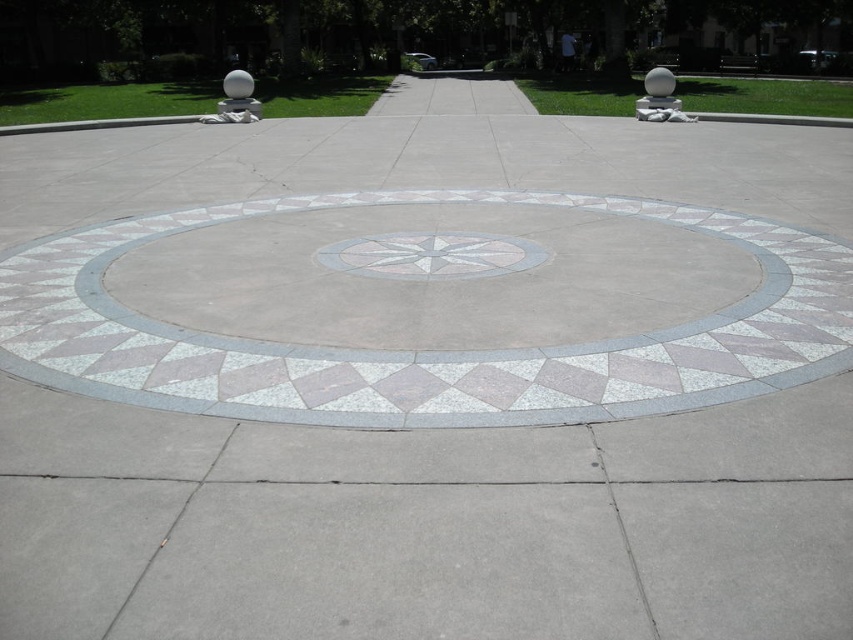
Looking at this image, does white mosaic circle at center appear on the right side of white marble compass at center?

Indeed, white mosaic circle at center is positioned on the right side of white marble compass at center.

Which is above, white mosaic circle at center or white marble compass at center?

white mosaic circle at center is above.

Is point (347, 28) closer to camera compared to point (433, 264)?

No, it is not.

Image resolution: width=853 pixels, height=640 pixels. In order to click on white mosaic circle at center in this screenshot , I will do `click(384, 49)`.